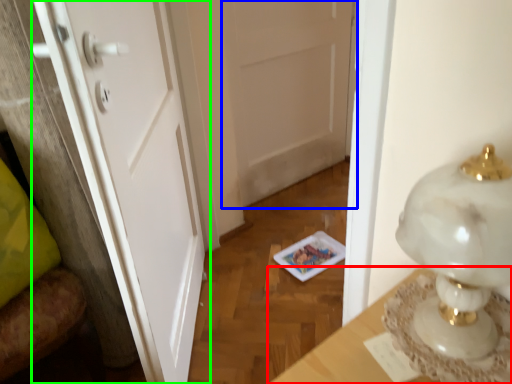
Question: Which object is the closest to the table (highlighted by a red box)? Choose among these: door (highlighted by a blue box) or door (highlighted by a green box).

Choices:
 (A) door
 (B) door

Answer: (B)